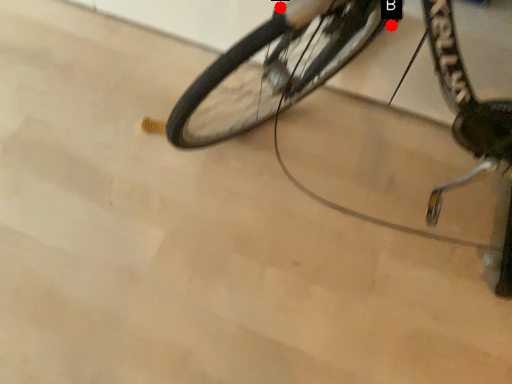
Question: Two points are circled on the image, labeled by A and B beside each circle. Among these points, which one is farthest from the camera?

Choices:
 (A) A is further
 (B) B is further

Answer: (B)